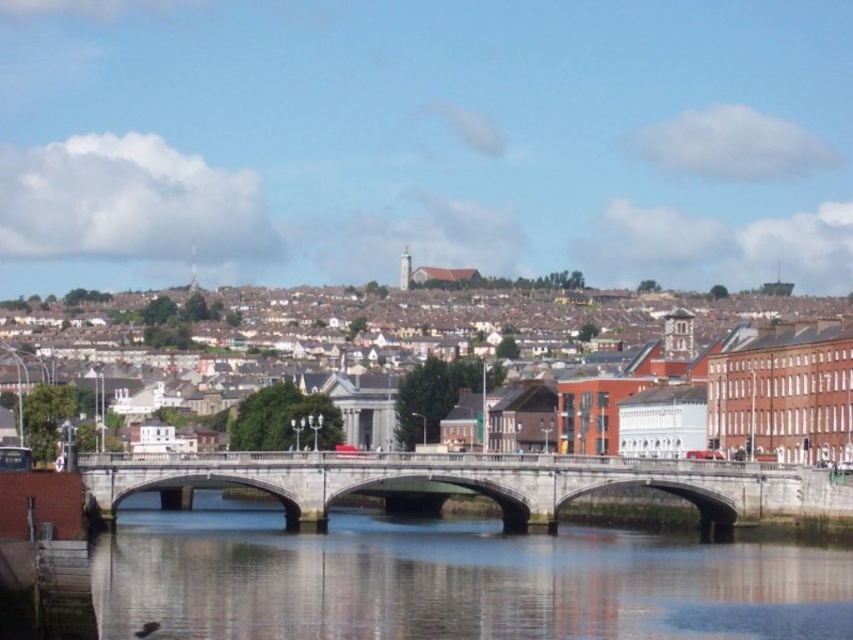
Question: Is matte brick town at upper center smaller than concrete bridge at center?

Choices:
 (A) yes
 (B) no

Answer: (B)

Question: Considering the relative positions of clear water at center and concrete bridge at center in the image provided, where is clear water at center located with respect to concrete bridge at center?

Choices:
 (A) right
 (B) left

Answer: (A)

Question: Is matte brick town at upper center smaller than concrete bridge at center?

Choices:
 (A) no
 (B) yes

Answer: (A)

Question: Which object appears farthest from the camera in this image?

Choices:
 (A) matte brick town at upper center
 (B) clear water at center
 (C) concrete bridge at center

Answer: (A)

Question: Estimate the real-world distances between objects in this image. Which object is farther from the concrete bridge at center?

Choices:
 (A) matte brick town at upper center
 (B) clear water at center

Answer: (A)

Question: Which of the following is the farthest from the observer?

Choices:
 (A) concrete bridge at center
 (B) clear water at center
 (C) matte brick town at upper center

Answer: (C)